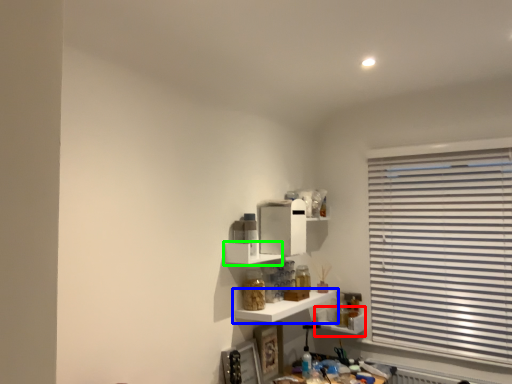
Question: Which is nearer to the shelf (highlighted by a red box)? shelf (highlighted by a blue box) or shelf (highlighted by a green box).

Choices:
 (A) shelf
 (B) shelf

Answer: (A)